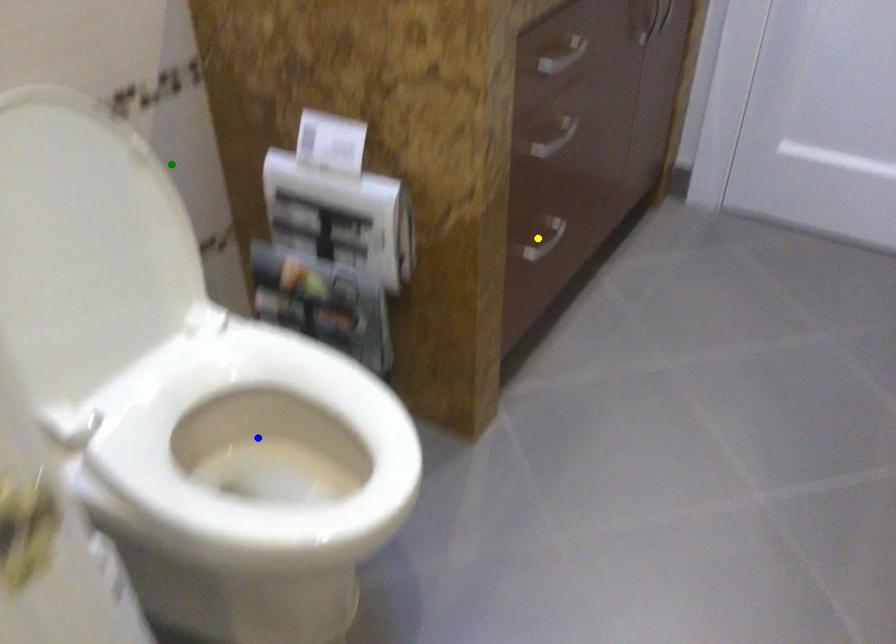
Order these from nearest to farthest:
A) yellow point
B) green point
C) blue point

yellow point
green point
blue point